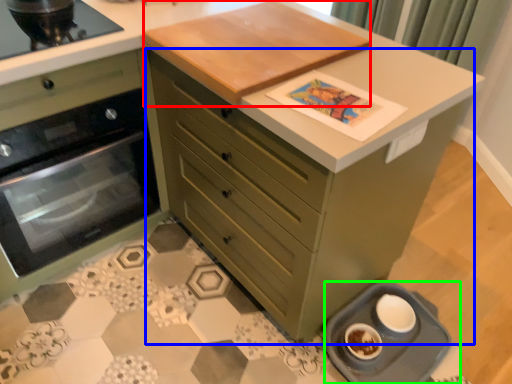
Question: Estimate the real-world distances between objects in this image. Which object is farther from table top (highlighted by a red box), chest of drawers (highlighted by a blue box) or appliance (highlighted by a green box)?

Choices:
 (A) chest of drawers
 (B) appliance

Answer: (B)